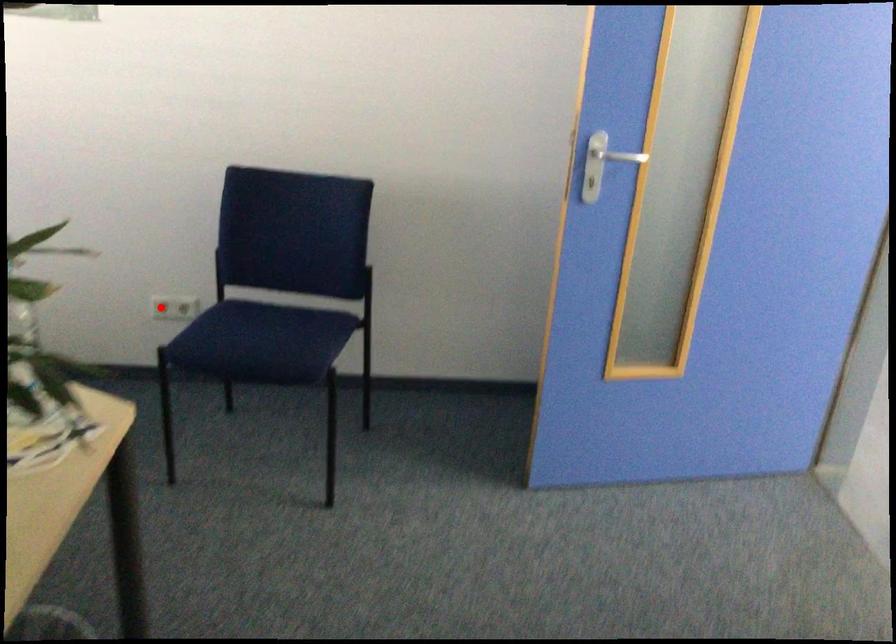
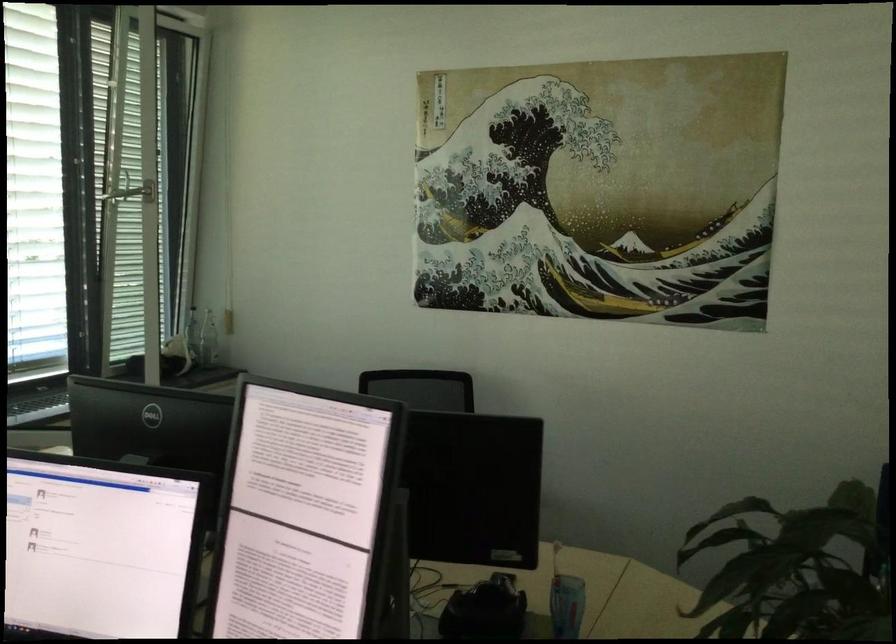
Question: I am providing you with two images of the same scene from different viewpoints. A red point is marked on the first image. Can you still see the location of the red point in image 2?

Choices:
 (A) Yes
 (B) No

Answer: (B)